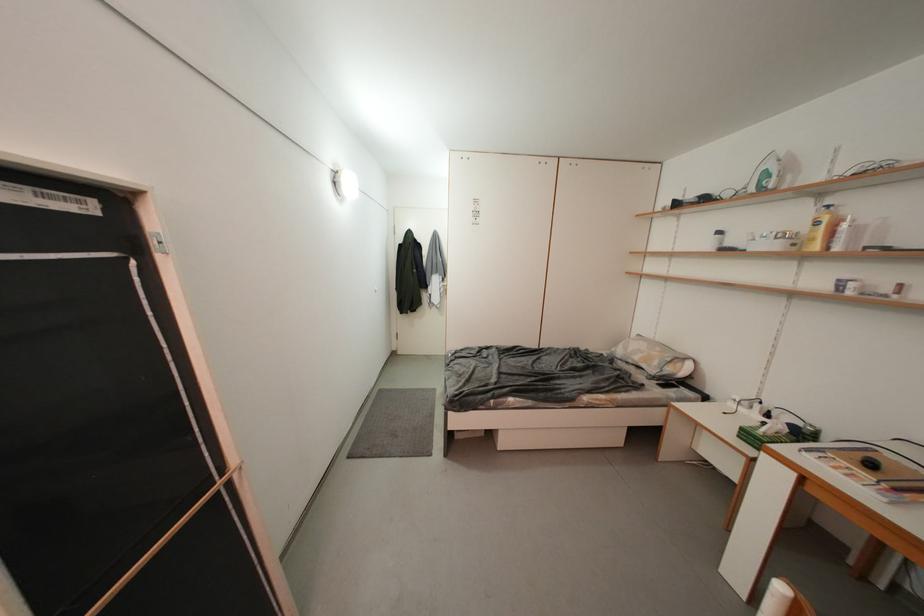
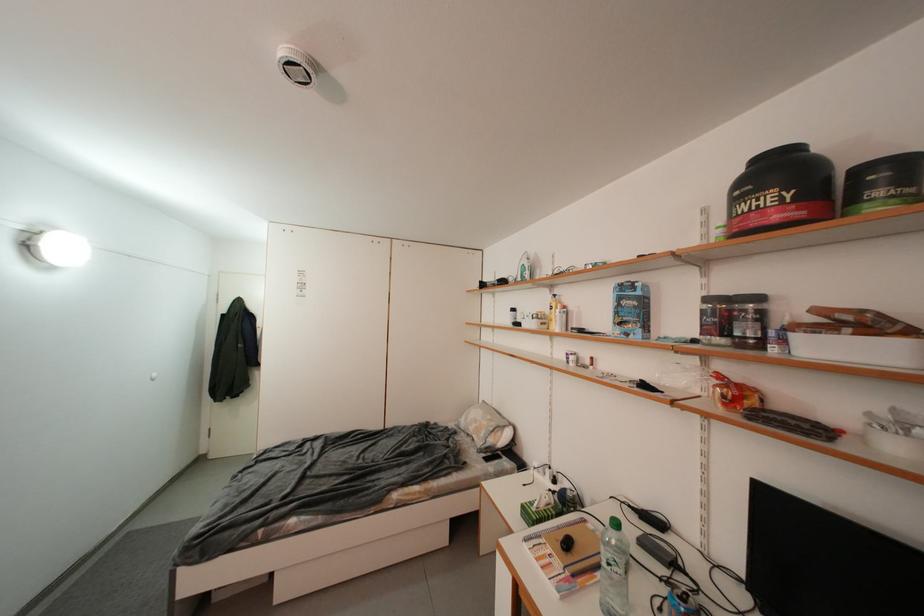
Where in the second image is the point corresponding to (818,204) from the first image?

(554, 294)